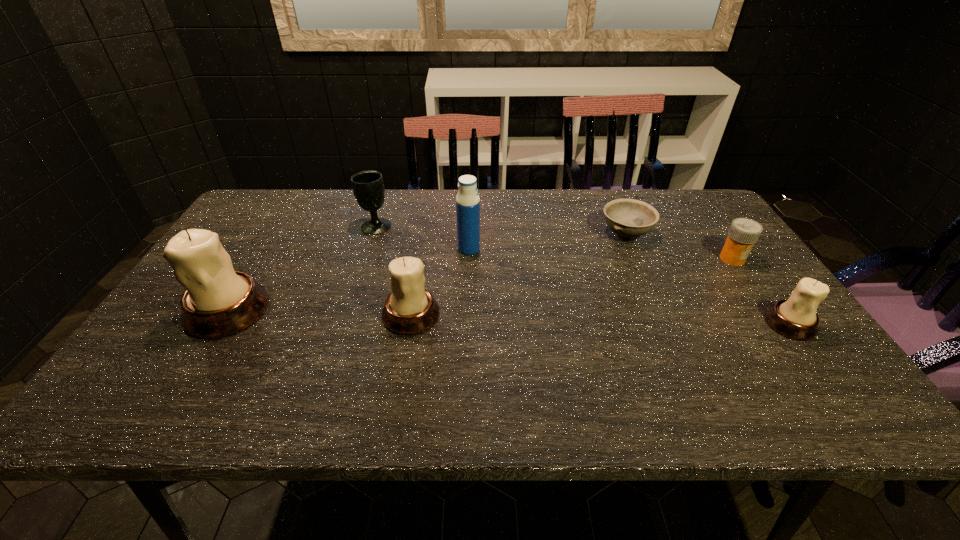
Locate an element on the screen. The image size is (960, 540). the second closest candle holder relative to the second object from left to right is located at coordinates (219, 301).

I want to click on vacant point that satisfies the following two spatial constraints: 1. on the front side of the chalice; 2. on the left side of the second shortest candle holder, so click(x=348, y=315).